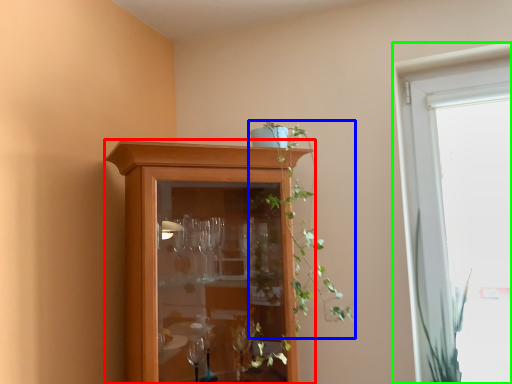
Question: Considering the real-world distances, which object is closest to cupboard (highlighted by a red box)? houseplant (highlighted by a blue box) or window (highlighted by a green box).

Choices:
 (A) houseplant
 (B) window

Answer: (A)